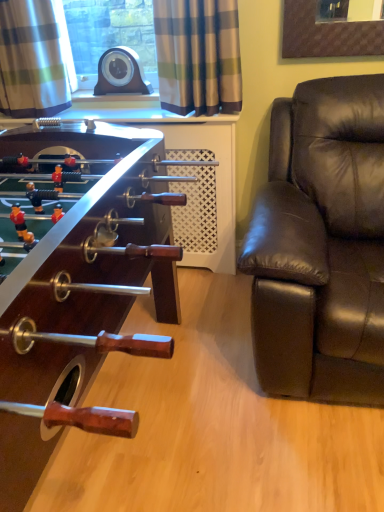
Question: From a real-world perspective, is plaid fabric curtain at upper left, placed as the 1th curtain when sorted from left to right, below plaid fabric curtain at upper center, the first curtain viewed from the right?

Choices:
 (A) no
 (B) yes

Answer: (A)

Question: Is plaid fabric curtain at upper left, placed as the 1th curtain when sorted from left to right, shorter than plaid fabric curtain at upper center, the first curtain viewed from the right?

Choices:
 (A) no
 (B) yes

Answer: (A)

Question: Does plaid fabric curtain at upper left, placed as the 1th curtain when sorted from left to right, come behind plaid fabric curtain at upper center, the first curtain viewed from the right?

Choices:
 (A) no
 (B) yes

Answer: (B)

Question: Does plaid fabric curtain at upper left, placed as the 1th curtain when sorted from left to right, turn towards plaid fabric curtain at upper center, the first curtain viewed from the right?

Choices:
 (A) yes
 (B) no

Answer: (B)

Question: Is plaid fabric curtain at upper left, placed as the 1th curtain when sorted from left to right, thinner than plaid fabric curtain at upper center, the first curtain viewed from the right?

Choices:
 (A) yes
 (B) no

Answer: (B)

Question: Is wooden foosball table at left wider or thinner than plaid fabric curtain at upper center, marked as the 2th curtain in a left-to-right arrangement?

Choices:
 (A) wide
 (B) thin

Answer: (A)

Question: From a real-world perspective, relative to plaid fabric curtain at upper center, marked as the 2th curtain in a left-to-right arrangement, is wooden foosball table at left vertically above or below?

Choices:
 (A) below
 (B) above

Answer: (A)

Question: Is wooden foosball table at left spatially inside plaid fabric curtain at upper center, marked as the 2th curtain in a left-to-right arrangement, or outside of it?

Choices:
 (A) outside
 (B) inside

Answer: (A)

Question: Looking at the image, does wooden foosball table at left seem bigger or smaller compared to plaid fabric curtain at upper center, the first curtain viewed from the right?

Choices:
 (A) big
 (B) small

Answer: (A)

Question: Based on their sizes in the image, would you say wooden foosball table at left is bigger or smaller than brown leather couch at right?

Choices:
 (A) small
 (B) big

Answer: (B)

Question: Is point (122, 167) closer or farther from the camera than point (281, 164)?

Choices:
 (A) closer
 (B) farther

Answer: (A)

Question: From a real-world perspective, is wooden foosball table at left physically located above or below brown leather couch at right?

Choices:
 (A) below
 (B) above

Answer: (A)

Question: Is wooden foosball table at left inside the boundaries of brown leather couch at right, or outside?

Choices:
 (A) outside
 (B) inside

Answer: (A)

Question: From the image's perspective, is brown leather couch at right positioned above or below plaid fabric curtain at upper center, marked as the 2th curtain in a left-to-right arrangement?

Choices:
 (A) above
 (B) below

Answer: (B)

Question: Choose the correct answer: Is brown leather couch at right inside plaid fabric curtain at upper center, marked as the 2th curtain in a left-to-right arrangement, or outside it?

Choices:
 (A) inside
 (B) outside

Answer: (B)